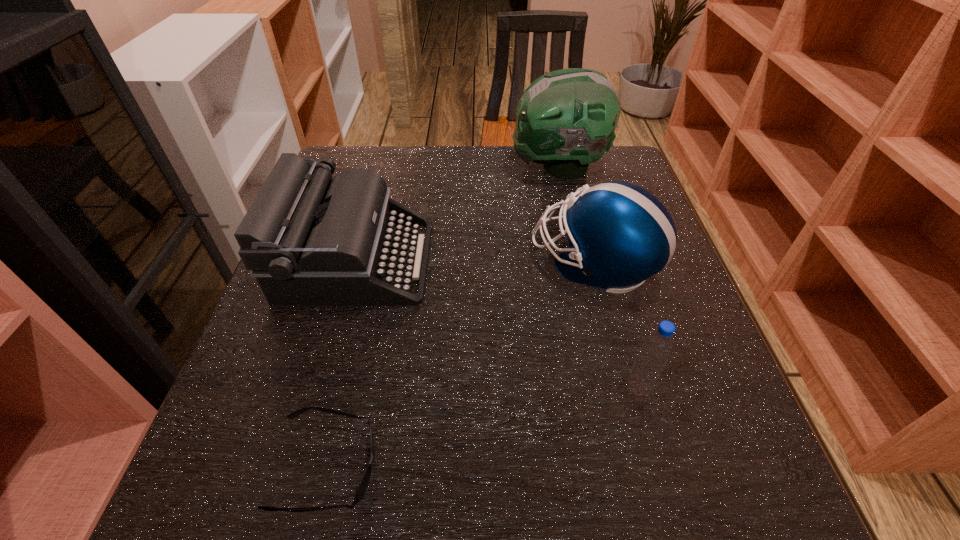
Locate an element on the screen. The height and width of the screenshot is (540, 960). the taller football helmet is located at coordinates (566, 119).

Find the location of a particular element. the farther football helmet is located at coordinates 566,119.

Locate an element on the screen. This screenshot has width=960, height=540. the nearer football helmet is located at coordinates (619, 234).

Where is `typewriter`? typewriter is located at coordinates (309, 239).

The height and width of the screenshot is (540, 960). I want to click on water bottle, so click(657, 348).

Where is `sunglasses`? sunglasses is located at coordinates (363, 484).

Identify the location of the nearest object. Image resolution: width=960 pixels, height=540 pixels. (363, 484).

This screenshot has height=540, width=960. Find the location of `vacant region located on the visor of the farther football helmet`. vacant region located on the visor of the farther football helmet is located at coordinates (437, 167).

The height and width of the screenshot is (540, 960). I want to click on vacant area located 0.210m on the visor of the farther football helmet, so click(x=434, y=167).

You are a GUI agent. You are given a task and a screenshot of the screen. Output one action in this format:
    pyautogui.click(x=<x>, y=<y>)
    Task: Click on the vacant space located on the visor of the farther football helmet
    Image resolution: width=960 pixels, height=540 pixels.
    Given the screenshot: What is the action you would take?
    pyautogui.click(x=422, y=167)